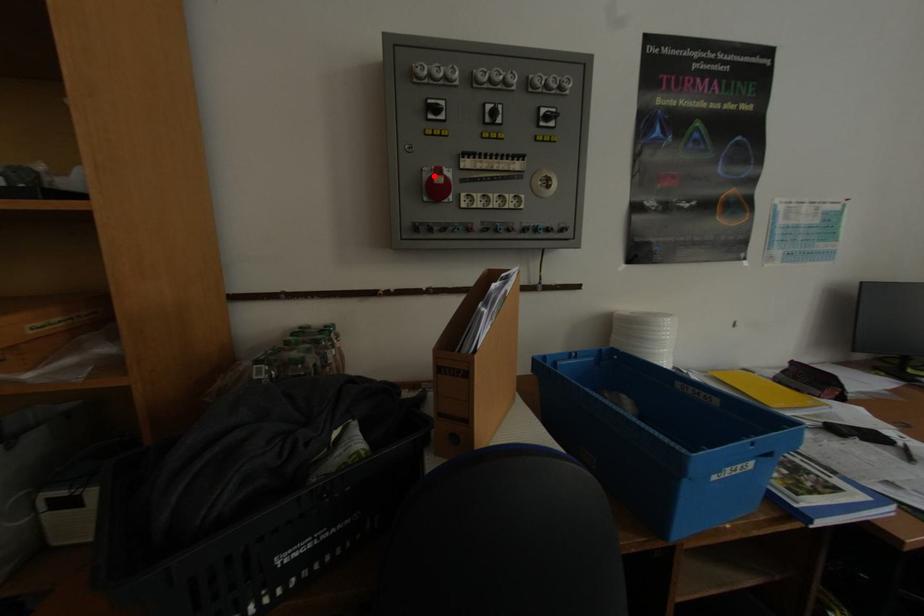
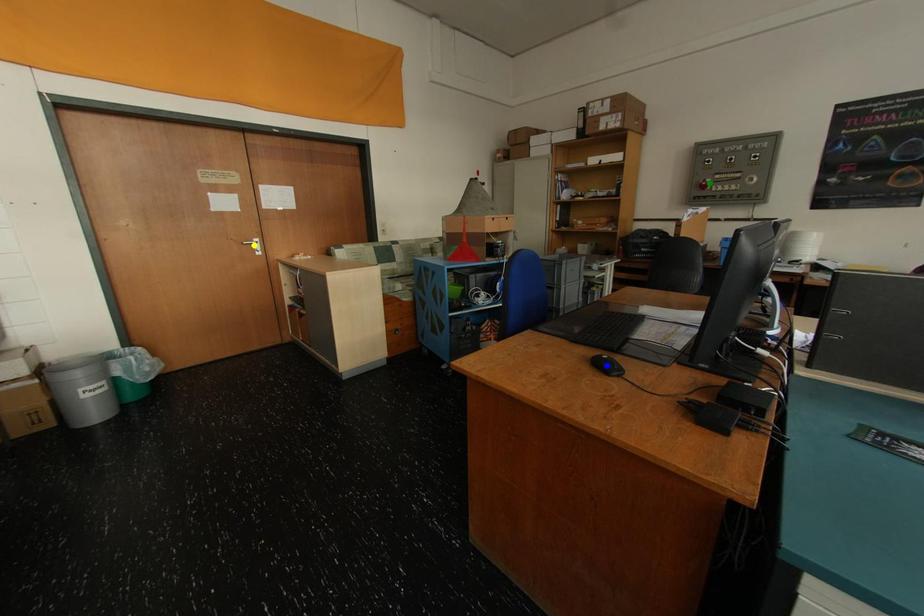
Question: I am providing you with two images of the same scene from different viewpoints. A red point is marked on the first image. You are given multiple points on the second image. In image 2, which mark is for the same physical point as the one in image 1?

Choices:
 (A) yellow point
 (B) green point
 (C) blue point

Answer: (B)